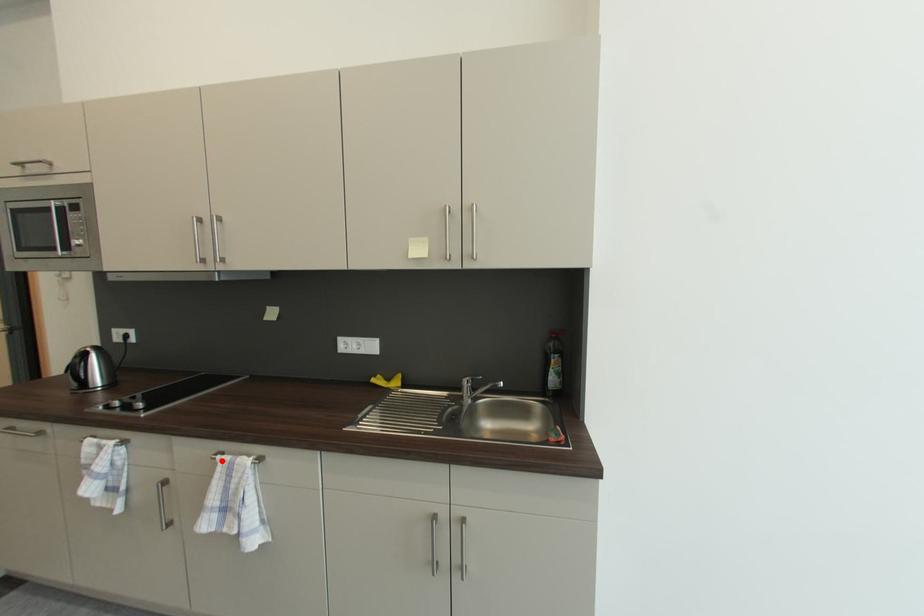
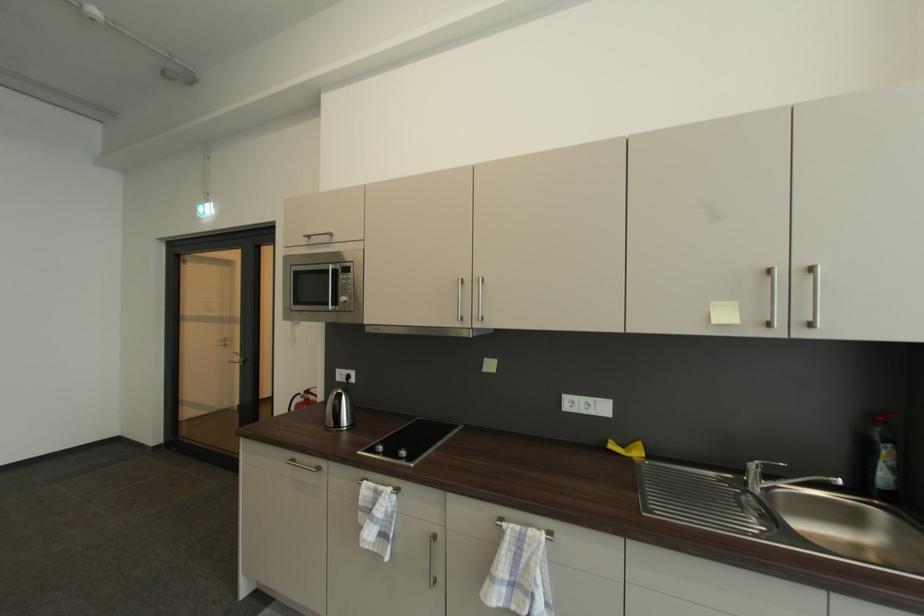
Find the pixel in the second image that matches the highlighted location in the first image.

(507, 529)